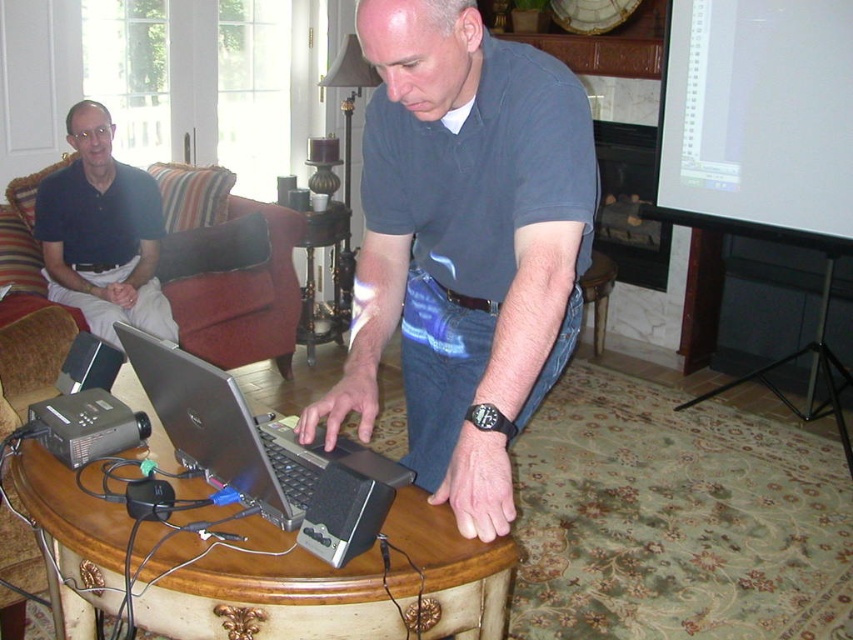
Can you confirm if matte black laptop at center is bigger than suede-like fabric armchair at left?

Actually, matte black laptop at center might be smaller than suede-like fabric armchair at left.

Who is shorter, matte black laptop at center or suede-like fabric armchair at left?

matte black laptop at center

Between point (373, 307) and point (292, 314), which one is positioned in front?

Positioned in front is point (373, 307).

Where is `matte black laptop at center`? The width and height of the screenshot is (853, 640). matte black laptop at center is located at coordinates (463, 243).

Between matte black laptop at center and metallic gold side table at center, which one is positioned lower?

matte black laptop at center

Does matte black laptop at center appear over metallic gold side table at center?

Actually, matte black laptop at center is below metallic gold side table at center.

Is point (386, 218) closer to viewer compared to point (346, 252)?

Yes.

Identify the location of matte black laptop at center. (463, 243).

Does metallic gold side table at center have a greater height compared to wooden stool at lower center?

Yes.

Consider the image. Measure the distance between point (340, 328) and camera.

Point (340, 328) and camera are 4.08 meters apart from each other.

The height and width of the screenshot is (640, 853). In order to click on metallic gold side table at center in this screenshot , I will do `click(331, 275)`.